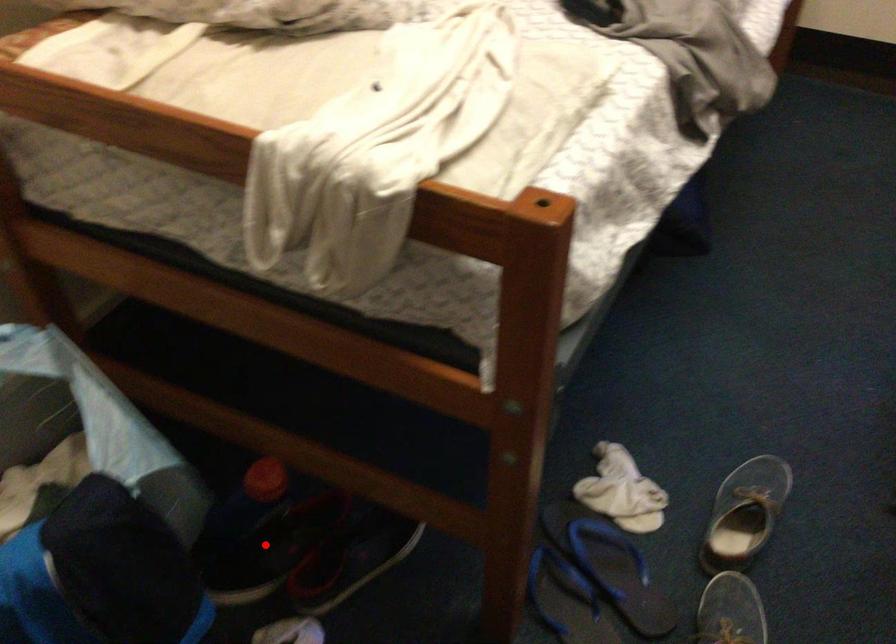
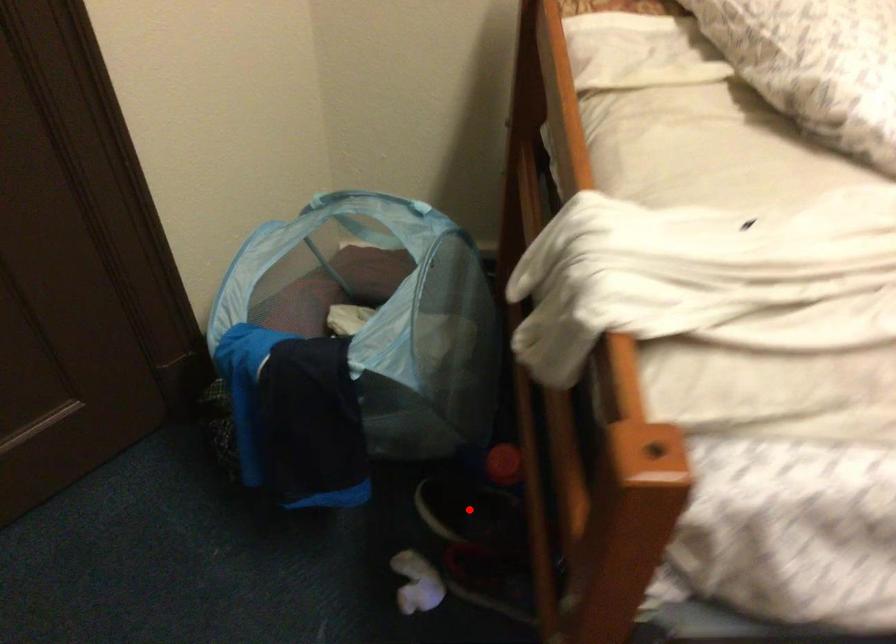
I am providing you with two images of the same scene from different viewpoints. A red point is marked on the first image and another point is marked on the second image. Is the red point in image1 aligned with the point shown in image2?

Yes